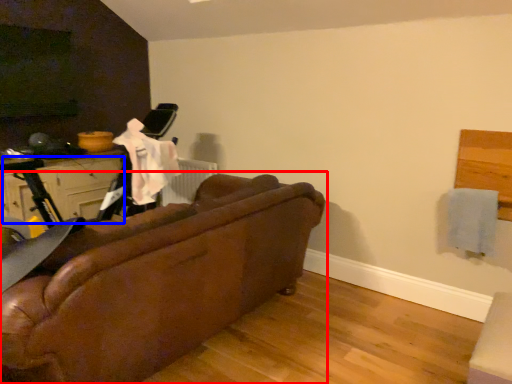
Question: Which object is further to the camera taking this photo, studio couch (highlighted by a red box) or drawer (highlighted by a blue box)?

Choices:
 (A) studio couch
 (B) drawer

Answer: (B)